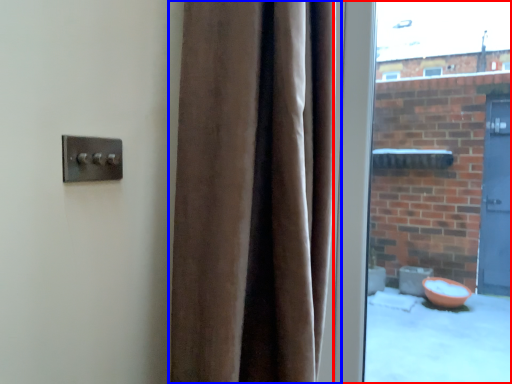
Question: Which object appears closest to the camera in this image, window (highlighted by a red box) or curtain (highlighted by a blue box)?

Choices:
 (A) window
 (B) curtain

Answer: (B)